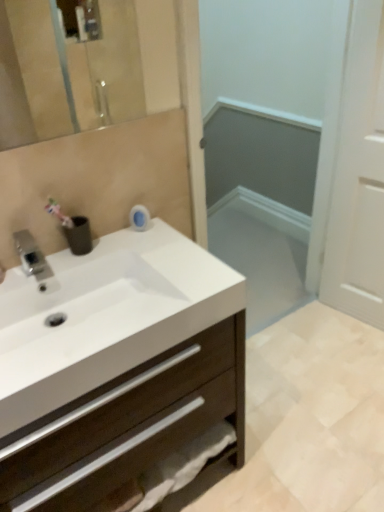
Question: Based on their positions, is white glossy screen door at center, which appears as the 2th screen door when viewed from the right, located to the left or right of white matte door at right, the first screen door when ordered from right to left?

Choices:
 (A) right
 (B) left

Answer: (B)

Question: Does point click(x=258, y=90) appear closer or farther from the camera than point click(x=367, y=197)?

Choices:
 (A) closer
 (B) farther

Answer: (B)

Question: Which object is positioned closest to the white glossy screen door at center, which appears as the 2th screen door when viewed from the right?

Choices:
 (A) silver metallic faucet at upper left
 (B) white matte cabinet at center
 (C) white matte door at right, the first screen door when ordered from right to left

Answer: (C)

Question: Estimate the real-world distances between objects in this image. Which object is closer to the white glossy screen door at center, which appears as the 2th screen door when viewed from the right?

Choices:
 (A) white matte door at right, the first screen door when ordered from right to left
 (B) silver metallic faucet at upper left
 (C) white matte cabinet at center

Answer: (A)